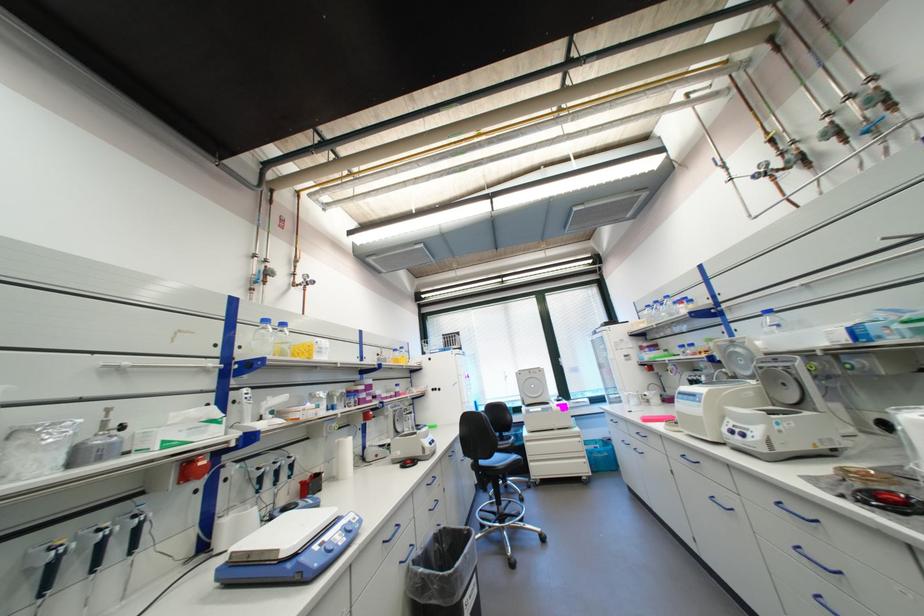
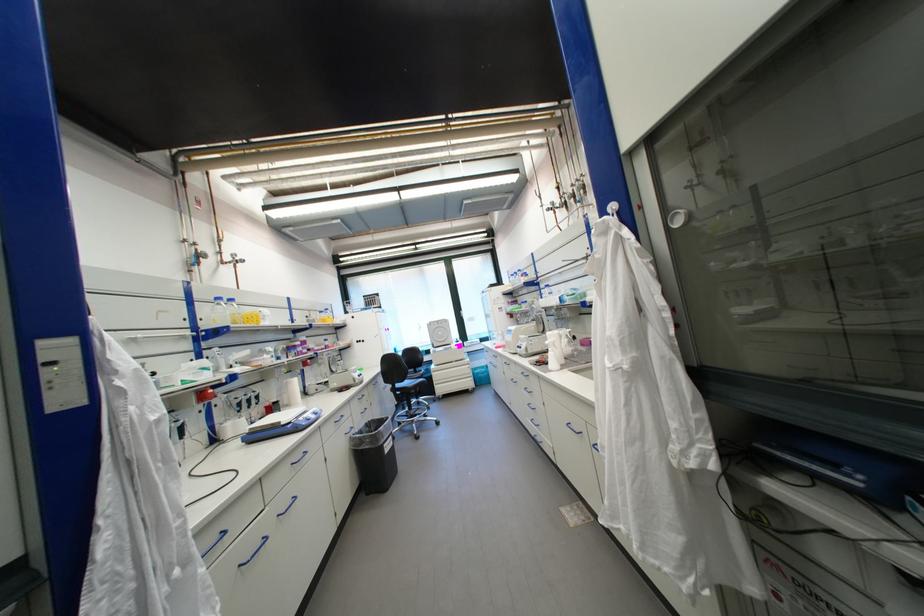
Question: The camera is either moving clockwise (left) or counter-clockwise (right) around the object. The first image is from the beginning of the video and the second image is from the end. Is the camera moving left or right when shooting the video?

Choices:
 (A) Left
 (B) Right

Answer: (A)